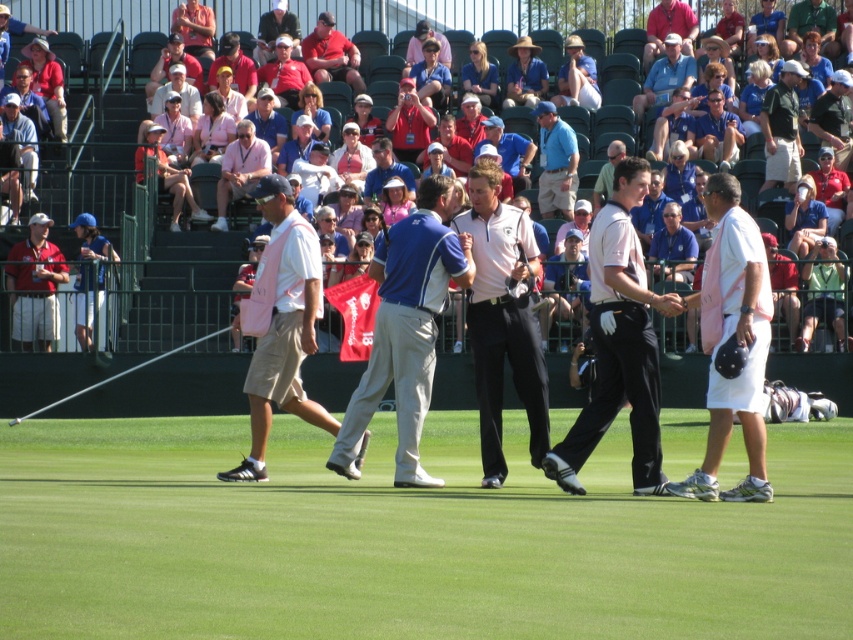
Which is behind, point (642, 424) or point (270, 156)?

The point (270, 156) is behind.

Can you confirm if light pink smooth shirt at center is shorter than pink fabric shirt at upper center?

No, light pink smooth shirt at center is not shorter than pink fabric shirt at upper center.

The image size is (853, 640). In order to click on light pink smooth shirt at center in this screenshot , I will do `click(619, 342)`.

The image size is (853, 640). I want to click on light pink smooth shirt at center, so click(x=619, y=342).

Which is more to the left, matte red shirt at center or white cotton shirt at center?

From the viewer's perspective, matte red shirt at center appears more on the left side.

Is matte red shirt at center to the right of white cotton shirt at center from the viewer's perspective?

In fact, matte red shirt at center is to the left of white cotton shirt at center.

Image resolution: width=853 pixels, height=640 pixels. Identify the location of matte red shirt at center. (331, 54).

Is matte pink shirt at left shorter than matte white shirt at center?

Incorrect, matte pink shirt at left's height does not fall short of matte white shirt at center's.

Is matte pink shirt at left positioned behind matte white shirt at center?

No.

The height and width of the screenshot is (640, 853). What are the coordinates of `matte pink shirt at left` in the screenshot? It's located at (35, 285).